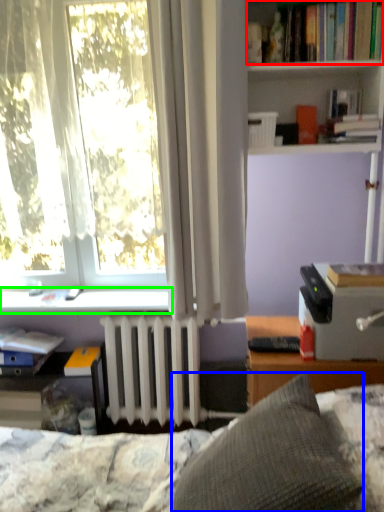
Question: Which object is positioned closest to book (highlighted by a red box)? Select from pillow (highlighted by a blue box) and window sill (highlighted by a green box).

Choices:
 (A) pillow
 (B) window sill

Answer: (B)